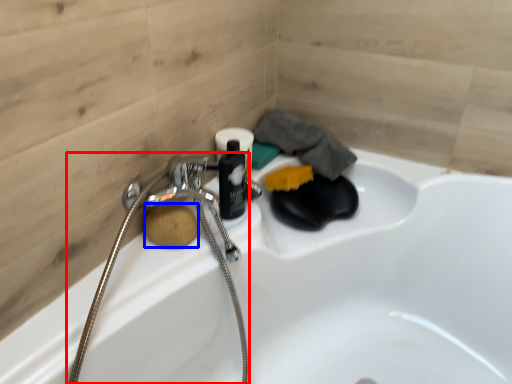
Question: Which point is closer to the camera, garden hose (highlighted by a red box) or soap (highlighted by a blue box)?

Choices:
 (A) garden hose
 (B) soap

Answer: (A)